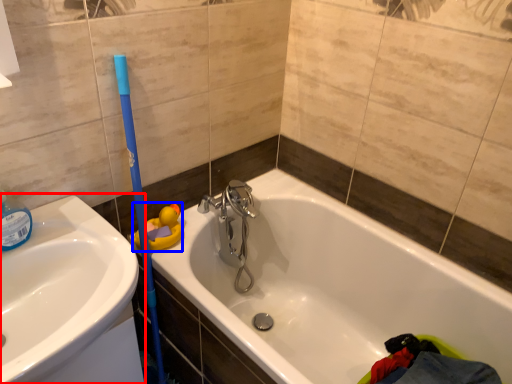
Question: Which object is closer to the camera taking this photo, sink (highlighted by a red box) or toy (highlighted by a blue box)?

Choices:
 (A) sink
 (B) toy

Answer: (A)